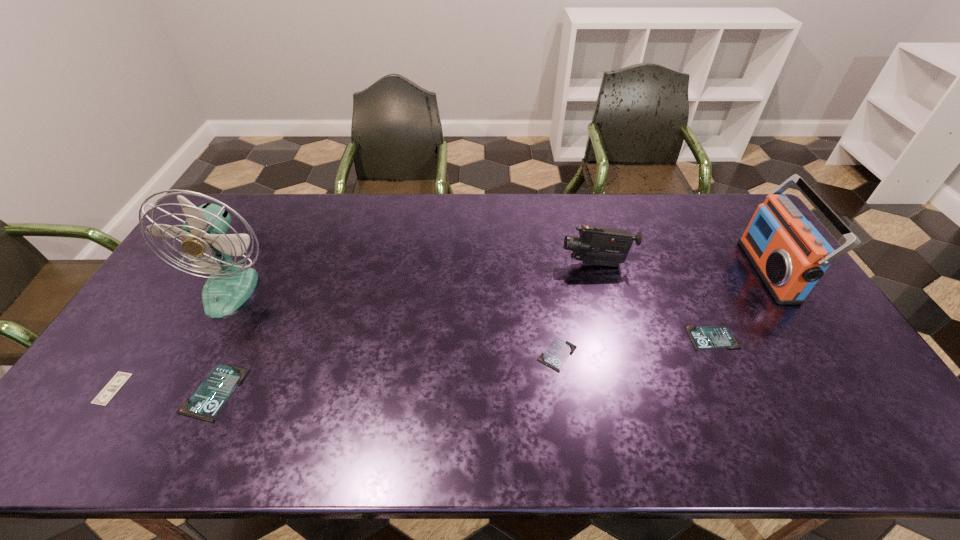
Please mark a free spot for a new identity_card to balance the arrangement. Please provide its 2D coordinates. Your answer should be formatted as a tuple, i.e. [(x, y)], where the tuple contains the x and y coordinates of a point satisfying the conditions above.

[(392, 373)]